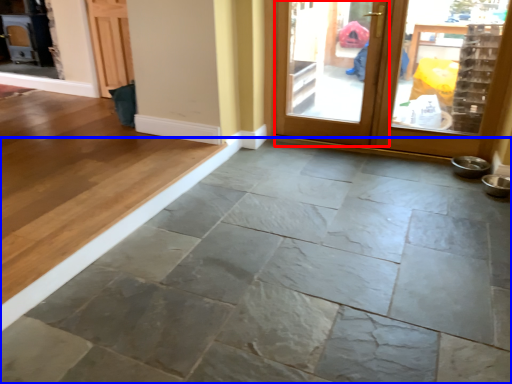
Question: Among these objects, which one is farthest to the camera, screen door (highlighted by a red box) or concrete (highlighted by a blue box)?

Choices:
 (A) screen door
 (B) concrete

Answer: (A)